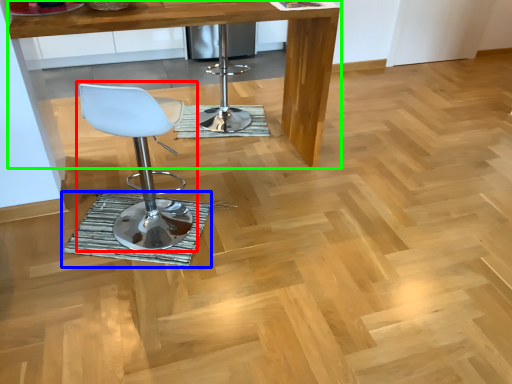
Question: Which object is the farthest from chair (highlighted by a red box)? Choose among these: mat (highlighted by a blue box) or table (highlighted by a green box).

Choices:
 (A) mat
 (B) table

Answer: (B)